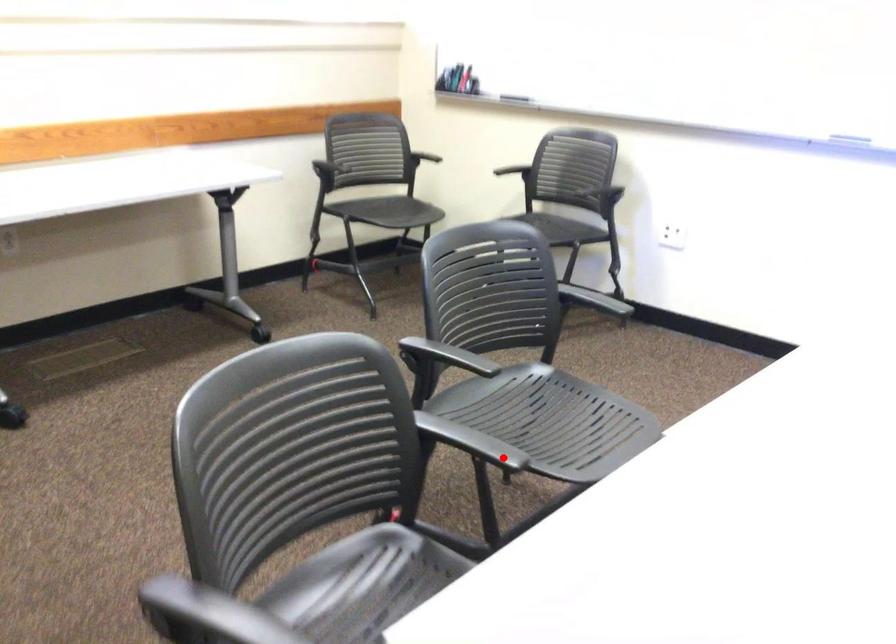
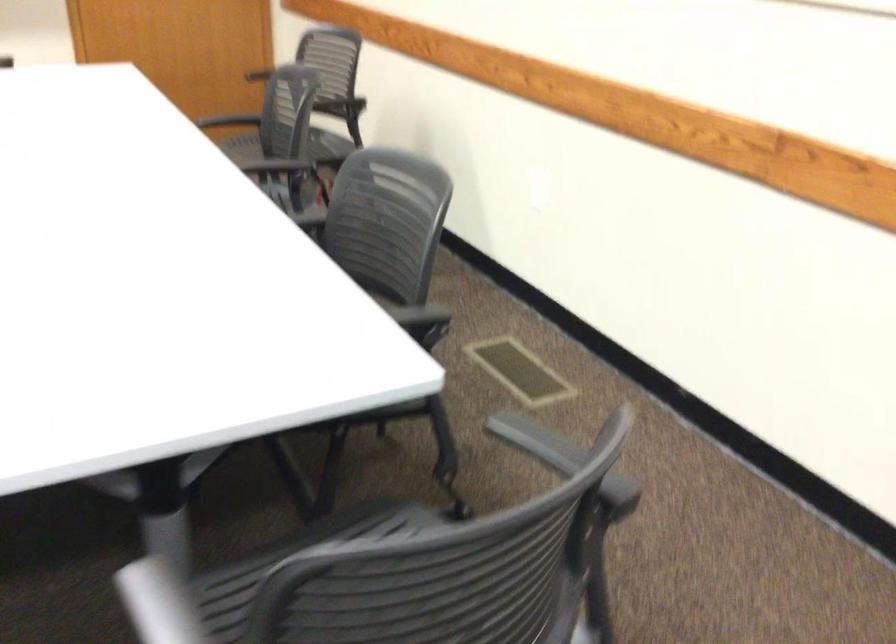
Where in the second image is the point corresponding to the highlighted location from the first image?

(158, 603)